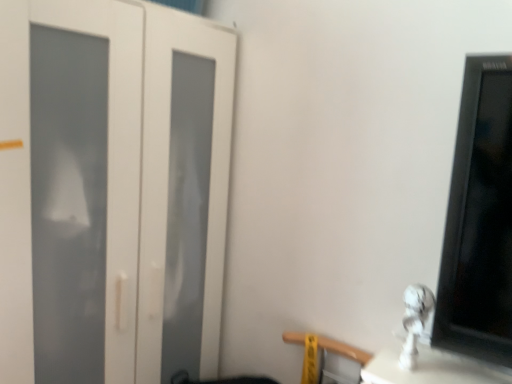
Question: Choose the correct answer: Is white glossy statue at lower right inside white matte door at left or outside it?

Choices:
 (A) outside
 (B) inside

Answer: (A)

Question: Would you say white glossy statue at lower right is to the left or to the right of white matte door at left in the picture?

Choices:
 (A) left
 (B) right

Answer: (B)

Question: Estimate the real-world distances between objects in this image. Which object is farther from the white matte door at left?

Choices:
 (A) white glossy statue at lower right
 (B) wooden at lower right

Answer: (A)

Question: Based on their relative distances, which object is farther from the wooden at lower right?

Choices:
 (A) white glossy statue at lower right
 (B) white matte door at left

Answer: (B)